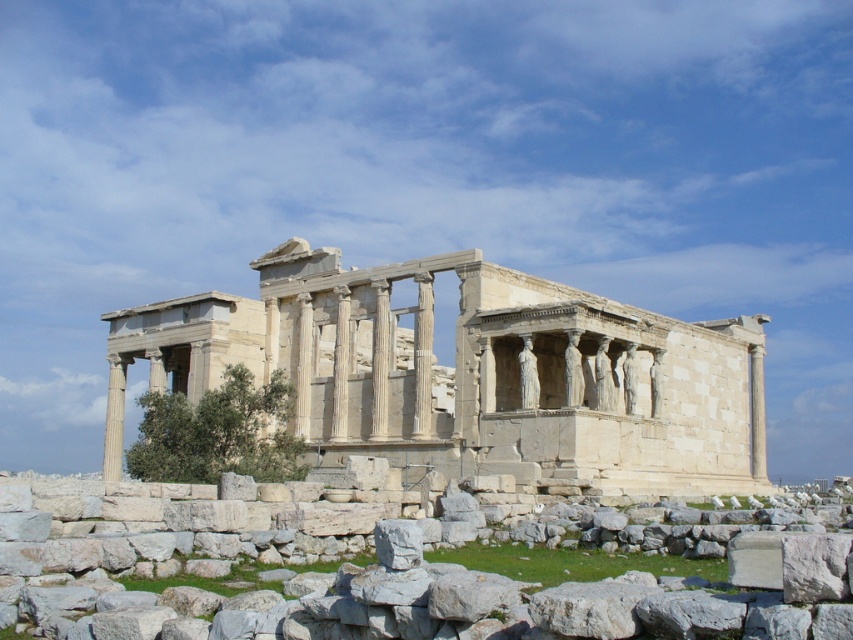
What do you see at coordinates (469, 372) in the screenshot?
I see `white stone ruins at center` at bounding box center [469, 372].

Which is behind, point (662, 349) or point (68, 532)?

Point (662, 349)

Identify the location of white stone ruins at center. Image resolution: width=853 pixels, height=640 pixels. (469, 372).